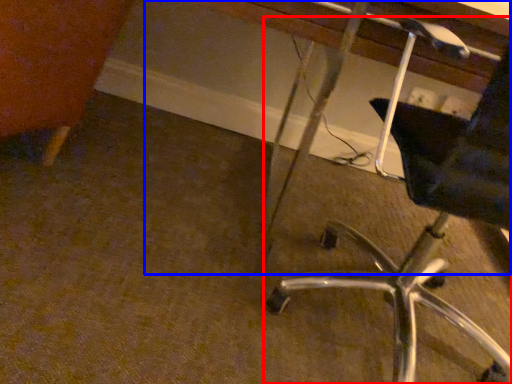
Question: Which of the following is the farthest to the observer, chair (highlighted by a red box) or vanity (highlighted by a blue box)?

Choices:
 (A) chair
 (B) vanity

Answer: (B)